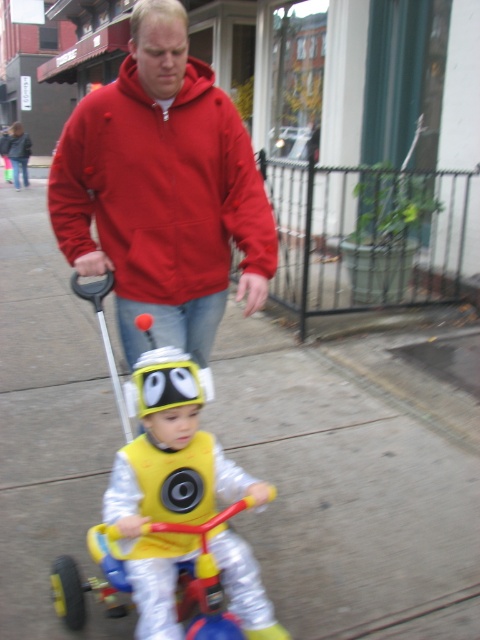
Question: Is concrete sidewalk at center in front of matte red jacket at upper center?

Choices:
 (A) yes
 (B) no

Answer: (B)

Question: Among these objects, which one is farthest from the camera?

Choices:
 (A) yellow plastic tricycle at center
 (B) concrete sidewalk at center
 (C) shiny silver costume at center
 (D) matte red jacket at upper center

Answer: (B)

Question: Which object appears farthest from the camera in this image?

Choices:
 (A) shiny silver costume at center
 (B) yellow plastic tricycle at center
 (C) concrete sidewalk at center
 (D) matte red jacket at upper center

Answer: (C)

Question: Which of the following is the farthest from the observer?

Choices:
 (A) yellow plastic tricycle at center
 (B) concrete sidewalk at center

Answer: (B)

Question: Can you confirm if concrete sidewalk at center is positioned above matte red jacket at upper center?

Choices:
 (A) yes
 (B) no

Answer: (B)

Question: Can you confirm if concrete sidewalk at center is bigger than matte red jacket at upper center?

Choices:
 (A) yes
 (B) no

Answer: (B)